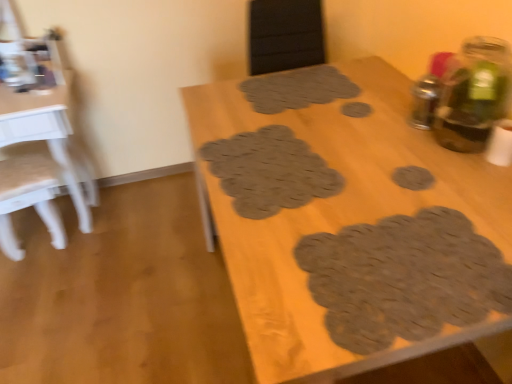
Where is `vacant area that lies between metallic silver bottle at upper right, which is counted as the first bottle, starting from the back, and brown textured coaster at center-right, positioned as the 4th footprint in top-to-bottom order`? The width and height of the screenshot is (512, 384). vacant area that lies between metallic silver bottle at upper right, which is counted as the first bottle, starting from the back, and brown textured coaster at center-right, positioned as the 4th footprint in top-to-bottom order is located at coordinates (418, 152).